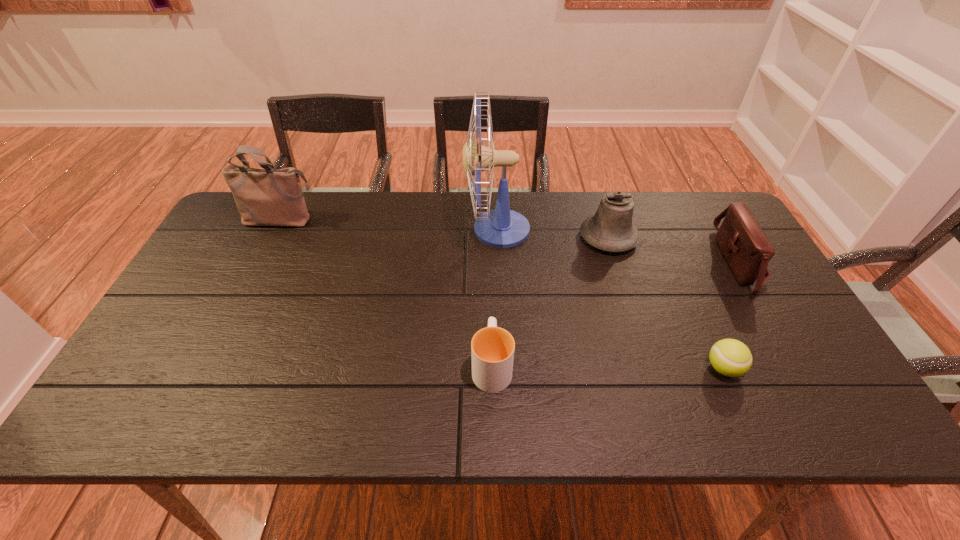
Identify which object is the fourth nearest to the fan. Please provide its 2D coordinates. Your answer should be formatted as a tuple, i.e. [(x, y)], where the tuple contains the x and y coordinates of a point satisfying the conditions above.

[(730, 357)]

Identify the location of vacant region that satisfies the following two spatial constraints: 1. on the front-facing side of the left shoulder bag; 2. on the left side of the fifth object from left to right. The height and width of the screenshot is (540, 960). (207, 368).

Locate an element on the screen. The image size is (960, 540). free space that satisfies the following two spatial constraints: 1. at the front of the tennis ball where the blades are visible; 2. on the right side of the tallest object is located at coordinates 503,368.

I want to click on free space that satisfies the following two spatial constraints: 1. at the front of the third object from right to left where the blades are visible; 2. on the right side of the tallest object, so click(497, 238).

Where is `vacant space that satisfies the following two spatial constraints: 1. with the handle on the side of the fourth object from left to right; 2. on the right side of the cup`? vacant space that satisfies the following two spatial constraints: 1. with the handle on the side of the fourth object from left to right; 2. on the right side of the cup is located at coordinates (489, 238).

What are the coordinates of `free spot that satisfies the following two spatial constraints: 1. on the front-facing side of the taller shoulder bag; 2. on the right side of the tennis ball` in the screenshot? It's located at (207, 368).